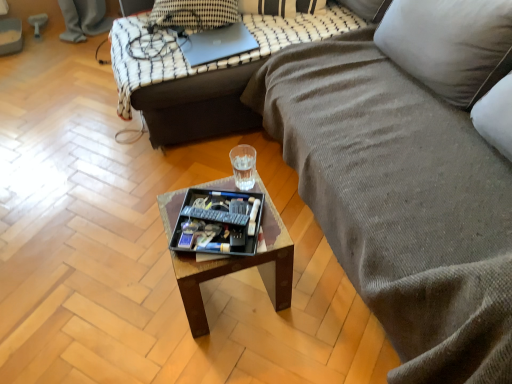
Question: In the image, is sleek silver laptop at upper center on the left side or the right side of textured gray fabric couch at center, which ranks as the 1th studio couch in front-to-back order?

Choices:
 (A) right
 (B) left

Answer: (B)

Question: Considering their positions, is sleek silver laptop at upper center located in front of or behind textured gray fabric couch at center, which ranks as the 1th studio couch in front-to-back order?

Choices:
 (A) front
 (B) behind

Answer: (B)

Question: Considering the real-world distances, which object is closest to the wooden tray at center?

Choices:
 (A) transparent plastic glass at center
 (B) sleek silver laptop at upper center
 (C) black plastic tray at center
 (D) textured gray fabric couch at center, positioned as the 2th studio couch in back-to-front order
 (E) metallic silver laptop at upper center, acting as the first studio couch starting from the back

Answer: (C)

Question: Which is nearer to the transparent plastic glass at center?

Choices:
 (A) black plastic remote control at center
 (B) black plastic tray at center
 (C) metallic gray swivel chair at upper left
 (D) wooden tray at center
 (E) sleek silver laptop at upper center

Answer: (E)